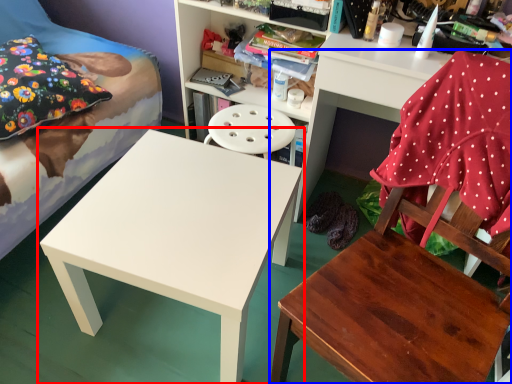
Question: Which of the following is the closest to the observer, table (highlighted by a red box) or chair (highlighted by a blue box)?

Choices:
 (A) table
 (B) chair

Answer: (B)